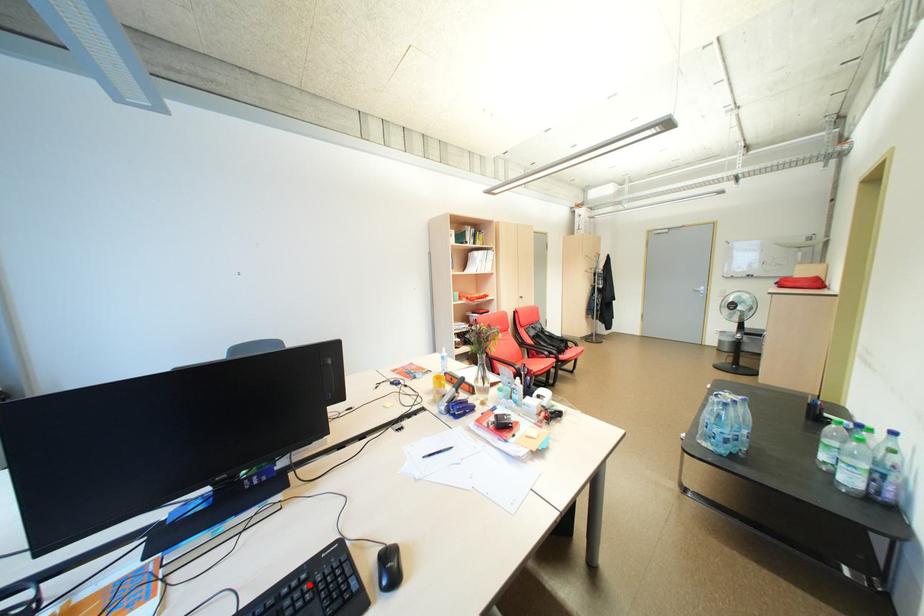
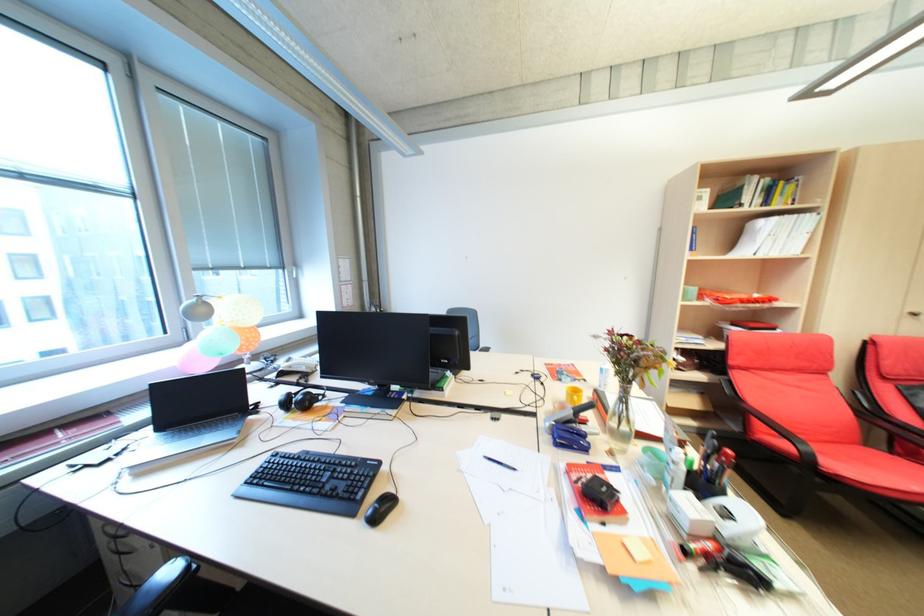
Locate, in the second image, the point that corresponds to the highlighted location in the first image.

(359, 467)